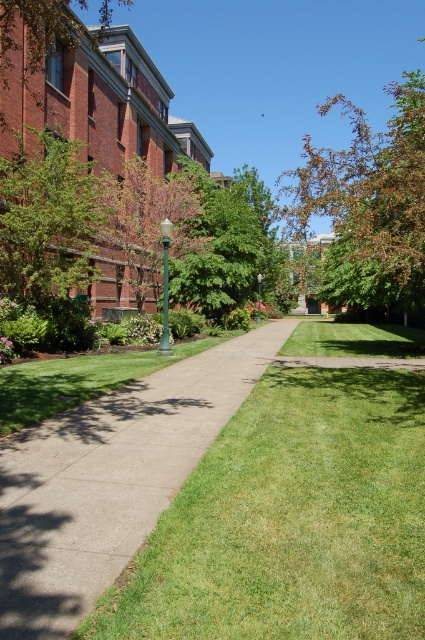
Question: Which of these objects is positioned closest to the brown leafy tree at upper center?

Choices:
 (A) brown wood tree at upper left
 (B) green leafy tree at center
 (C) concrete sidewalk at center

Answer: (B)

Question: Which point appears farthest from the camera in this image?

Choices:
 (A) (79, 227)
 (B) (192, 168)
 (C) (410, 232)
 (D) (260, 285)

Answer: (D)

Question: Is brown leafy tree at upper center positioned in front of brown wood tree at upper left?

Choices:
 (A) no
 (B) yes

Answer: (A)

Question: Does green leafy tree at center appear on the right side of green glass lamp post at center?

Choices:
 (A) yes
 (B) no

Answer: (B)

Question: Which point is farther from the camera taking this photo?

Choices:
 (A) pyautogui.click(x=263, y=275)
 (B) pyautogui.click(x=337, y=93)

Answer: (B)

Question: Considering the relative positions of brown wood tree at upper left and green metallic lamp post at center in the image provided, where is brown wood tree at upper left located with respect to green metallic lamp post at center?

Choices:
 (A) below
 (B) above

Answer: (B)